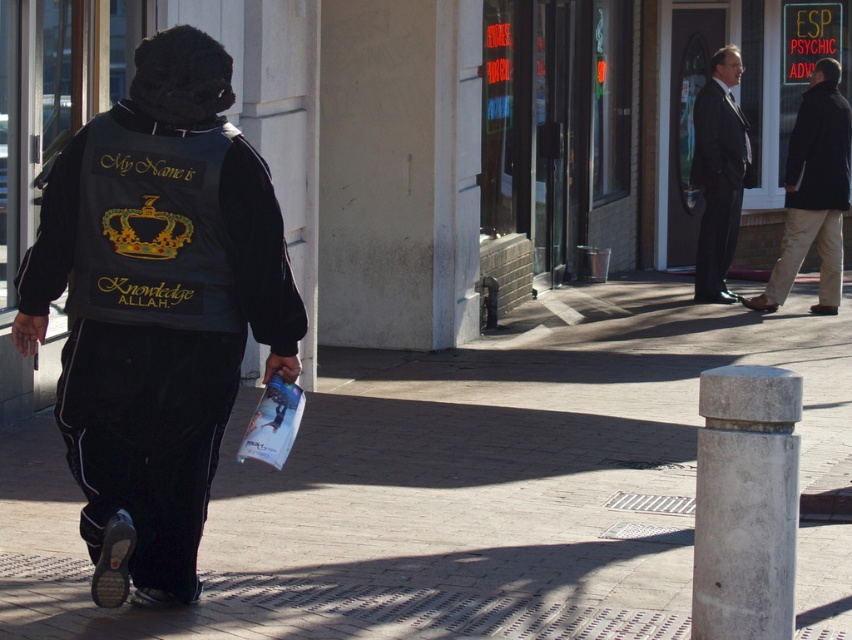
You are a photographer trying to capture both the dark brown leather coat at right and the black matte sweatshirt at upper right in a single shot. Based on their positions, which object should you adjust your camera angle to focus on first to ensure both are in frame?

The dark brown leather coat at right is to the left of the black matte sweatshirt at upper right, so you should focus on the dark brown leather coat at right first to ensure both are in frame.

You are a drone operator trying to capture a photo of the person holding the pamphlet. The camera on your drone can focus clearly up to 15 meters away. Given the scene described, will the camera be able to focus clearly on the person at point (830, 161)?

The distance between point (830, 161) and the camera is 14.40 meters, which is within the camera focus range of up to 15 meters. Therefore, the camera can focus clearly on the person at point (830, 161).

You are a tailor measuring the distance between two clothing items in the image. The dark brown leather coat at right and the black matte sweatshirt at upper right are displayed on a mannequin. Can you fit a 6.5 inch wide decorative ribbon between them?

The distance between the dark brown leather coat at right and the black matte sweatshirt at upper right is 6.66 inches, so yes, the 6.5 inch wide decorative ribbon can fit between them since the space is slightly larger than the ribbon.